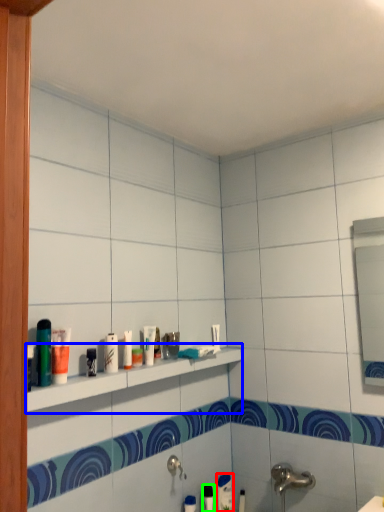
Question: Estimate the real-world distances between objects in this image. Which object is closer to toothpaste (highlighted by a red box), shelf (highlighted by a blue box) or toiletry (highlighted by a green box)?

Choices:
 (A) shelf
 (B) toiletry

Answer: (B)